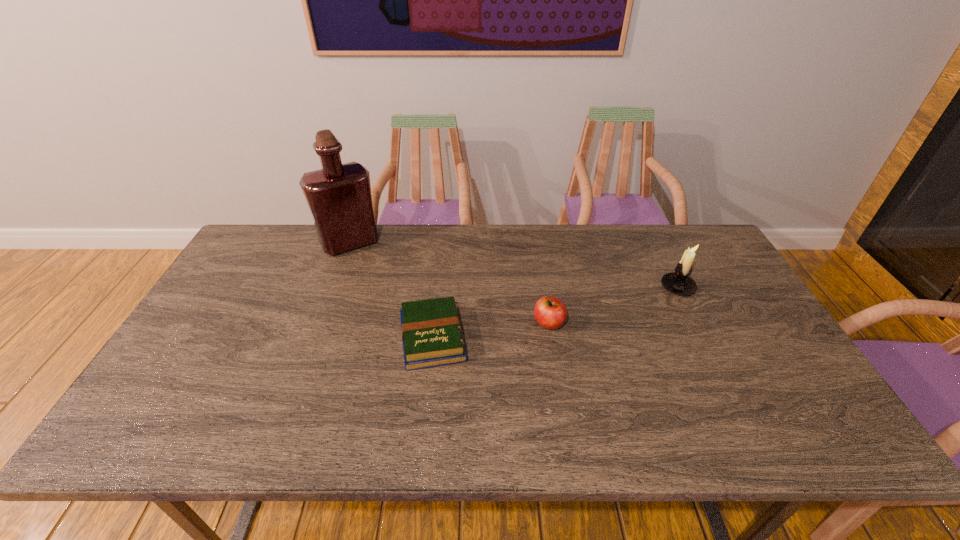
What are the coordinates of `the leftmost object` in the screenshot? It's located at (339, 197).

The image size is (960, 540). Identify the location of the tallest object. (339, 197).

This screenshot has height=540, width=960. Find the location of `the rightmost object`. the rightmost object is located at coordinates (678, 282).

Where is `the third nearest object`? the third nearest object is located at coordinates (678, 282).

This screenshot has height=540, width=960. What are the coordinates of `the third object from left to right` in the screenshot? It's located at (550, 312).

The width and height of the screenshot is (960, 540). What are the coordinates of `the second shortest object` in the screenshot? It's located at (550, 312).

You are a GUI agent. You are given a task and a screenshot of the screen. Output one action in this format:
    pyautogui.click(x=<x>, y=<y>)
    Task: Click on the shortest object
    This screenshot has width=960, height=540.
    Given the screenshot: What is the action you would take?
    pyautogui.click(x=432, y=336)

Locate an element on the screen. The width and height of the screenshot is (960, 540). book is located at coordinates (432, 336).

At what (x,y) coordinates should I click in order to perform the action: click on vacant position located 0.130m on the front of the liquor. Please return your answer as a coordinate pair (x, y). The width and height of the screenshot is (960, 540). Looking at the image, I should click on (334, 286).

The height and width of the screenshot is (540, 960). Find the location of `vacant space located 0.200m on the left of the rightmost object`. vacant space located 0.200m on the left of the rightmost object is located at coordinates (594, 287).